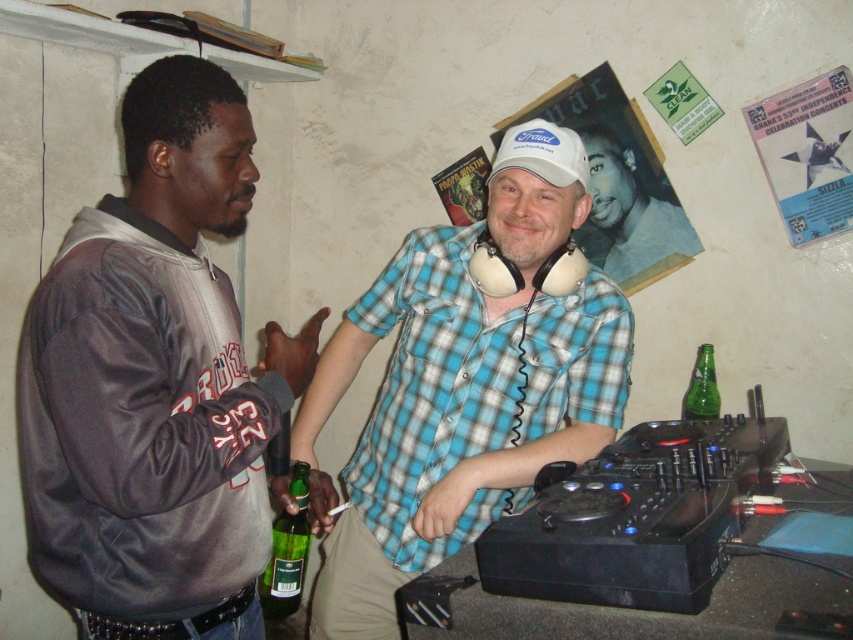
Question: Estimate the real-world distances between objects in this image. Which object is closer to the white matte headphones at upper center?

Choices:
 (A) green glass bottle at lower right
 (B) gray leather jacket at left
 (C) blue plaid shirt at center
 (D) green glass bottle at lower center

Answer: (A)

Question: Considering the real-world distances, which object is farthest from the white matte headphones at upper center?

Choices:
 (A) blue plaid shirt at center
 (B) gray leather jacket at left
 (C) green glass bottle at lower right

Answer: (B)

Question: Does blue plaid shirt at center appear under green glass bottle at lower center?

Choices:
 (A) yes
 (B) no

Answer: (B)

Question: Can you confirm if blue plaid shirt at center is bigger than white matte headphones at upper center?

Choices:
 (A) yes
 (B) no

Answer: (A)

Question: Considering the real-world distances, which object is closest to the gray leather jacket at left?

Choices:
 (A) green glass bottle at lower center
 (B) blue plaid shirt at center

Answer: (B)

Question: Is blue plaid shirt at center thinner than white matte headphones at upper center?

Choices:
 (A) yes
 (B) no

Answer: (B)